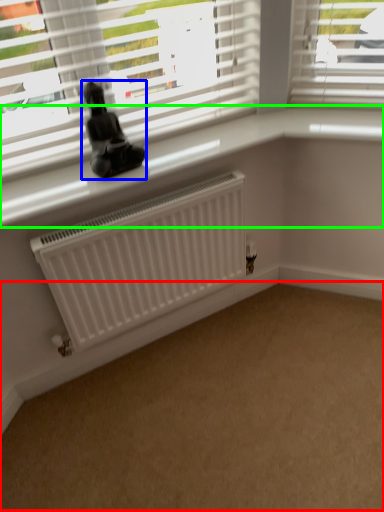
Question: Considering the real-world distances, which object is farthest from plain (highlighted by a red box)? miniature (highlighted by a blue box) or window sill (highlighted by a green box)?

Choices:
 (A) miniature
 (B) window sill

Answer: (A)